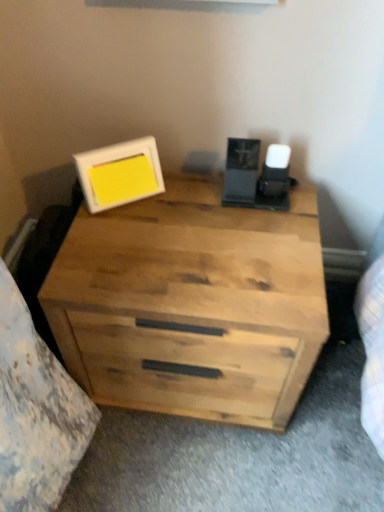
This screenshot has height=512, width=384. In order to click on vacant space in front of white matte picture frame at upper left in this screenshot , I will do `click(129, 250)`.